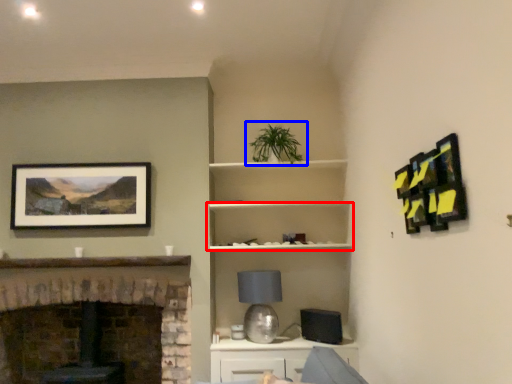
Question: Which of the following is the farthest to the observer, shelf (highlighted by a red box) or houseplant (highlighted by a blue box)?

Choices:
 (A) shelf
 (B) houseplant

Answer: (A)